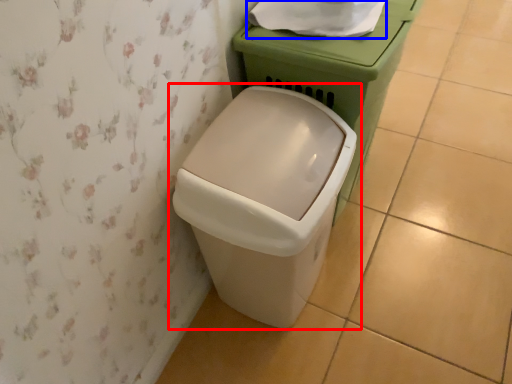
Question: Which point is further to the camera, waste container (highlighted by a red box) or toilet paper (highlighted by a blue box)?

Choices:
 (A) waste container
 (B) toilet paper

Answer: (B)